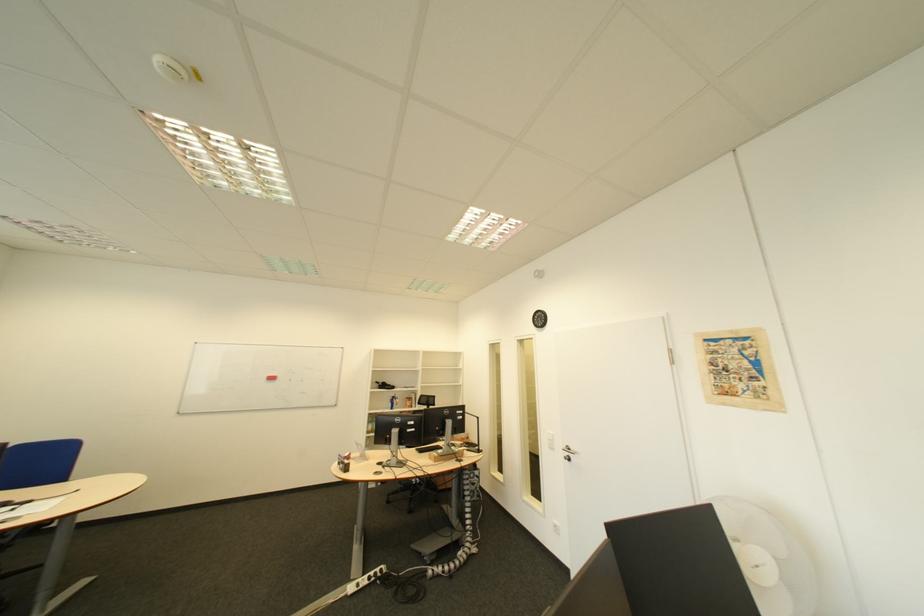
What are the coordinates of `silver door handle` in the screenshot? It's located at [568, 453].